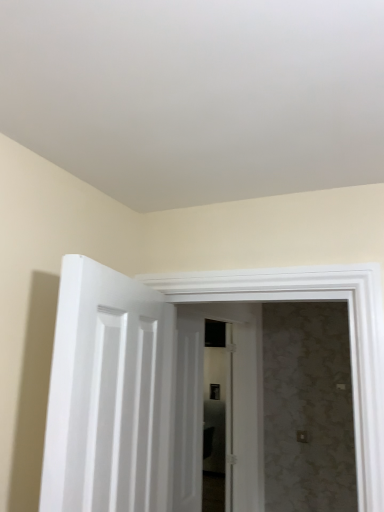
Where is `white painted wood door at left, which is the 2th door in back-to-front order`? The height and width of the screenshot is (512, 384). white painted wood door at left, which is the 2th door in back-to-front order is located at coordinates click(108, 394).

This screenshot has width=384, height=512. Describe the element at coordinates (108, 394) in the screenshot. I see `white painted wood door at left, which is the 2th door in back-to-front order` at that location.

Describe the element at coordinates (225, 406) in the screenshot. I see `white wooden door at center, the first door positioned from the back` at that location.

Where is `white wooden door at center, the first door positioned from the back`? white wooden door at center, the first door positioned from the back is located at coordinates (225, 406).

Identify the location of white painted wood door at left, positioned as the 1th door in front-to-back order. (108, 394).

Can you confirm if white painted wood door at left, positioned as the 1th door in front-to-back order, is positioned to the right of white wooden door at center, the first door positioned from the back?

No.

Between white painted wood door at left, which is the 2th door in back-to-front order, and white wooden door at center, marked as the 2th door in a front-to-back arrangement, which one is positioned behind?

white wooden door at center, marked as the 2th door in a front-to-back arrangement, is further away from the camera.

Is point (59, 426) in front of point (187, 473)?

Yes.

Based on the photo, from the image's perspective, is white painted wood door at left, which is the 2th door in back-to-front order, below white wooden door at center, marked as the 2th door in a front-to-back arrangement?

No, from the image's perspective, white painted wood door at left, which is the 2th door in back-to-front order, is not below white wooden door at center, marked as the 2th door in a front-to-back arrangement.

From a real-world perspective, is white painted wood door at left, which is the 2th door in back-to-front order, above or below white wooden door at center, the first door positioned from the back?

In terms of real-world spatial position, white painted wood door at left, which is the 2th door in back-to-front order, is above white wooden door at center, the first door positioned from the back.

Can you confirm if white painted wood door at left, which is the 2th door in back-to-front order, is thinner than white wooden door at center, the first door positioned from the back?

Correct, the width of white painted wood door at left, which is the 2th door in back-to-front order, is less than that of white wooden door at center, the first door positioned from the back.

Between white painted wood door at left, which is the 2th door in back-to-front order, and white wooden door at center, marked as the 2th door in a front-to-back arrangement, which one has more height?

white wooden door at center, marked as the 2th door in a front-to-back arrangement.

Considering the sizes of objects white painted wood door at left, which is the 2th door in back-to-front order, and white wooden door at center, marked as the 2th door in a front-to-back arrangement, in the image provided, who is bigger, white painted wood door at left, which is the 2th door in back-to-front order, or white wooden door at center, marked as the 2th door in a front-to-back arrangement,?

With larger size is white wooden door at center, marked as the 2th door in a front-to-back arrangement.

Is white wooden door at center, the first door positioned from the back, completely or partially inside white painted wood door at left, positioned as the 1th door in front-to-back order?

No, white painted wood door at left, positioned as the 1th door in front-to-back order, does not contain white wooden door at center, the first door positioned from the back.

Is white painted wood door at left, which is the 2th door in back-to-front order, directly adjacent to white wooden door at center, the first door positioned from the back?

white painted wood door at left, which is the 2th door in back-to-front order, is not next to white wooden door at center, the first door positioned from the back, and they're not touching.

Is white painted wood door at left, which is the 2th door in back-to-front order, oriented away from white wooden door at center, marked as the 2th door in a front-to-back arrangement?

No, white wooden door at center, marked as the 2th door in a front-to-back arrangement, is not at the back of white painted wood door at left, which is the 2th door in back-to-front order.

Can you tell me how much white painted wood door at left, which is the 2th door in back-to-front order, and white wooden door at center, the first door positioned from the back, differ in facing direction?

There is a 15.9-degree angle between the facing directions of white painted wood door at left, which is the 2th door in back-to-front order, and white wooden door at center, the first door positioned from the back.

This screenshot has height=512, width=384. Find the location of `door above the white wooden door at center, the first door positioned from the back (from the image's perspective)`. door above the white wooden door at center, the first door positioned from the back (from the image's perspective) is located at coordinates (108, 394).

Considering the positions of objects white wooden door at center, the first door positioned from the back, and white painted wood door at left, positioned as the 1th door in front-to-back order, in the image provided, who is more to the left, white wooden door at center, the first door positioned from the back, or white painted wood door at left, positioned as the 1th door in front-to-back order,?

white painted wood door at left, positioned as the 1th door in front-to-back order, is more to the left.

Is white wooden door at center, the first door positioned from the back, further to camera compared to white painted wood door at left, which is the 2th door in back-to-front order?

Yes, white wooden door at center, the first door positioned from the back, is behind white painted wood door at left, which is the 2th door in back-to-front order.

Is point (226, 402) closer to camera compared to point (169, 402)?

No, (226, 402) is behind (169, 402).

From the image's perspective, does white wooden door at center, the first door positioned from the back, appear lower than white painted wood door at left, which is the 2th door in back-to-front order?

Correct, white wooden door at center, the first door positioned from the back, appears lower than white painted wood door at left, which is the 2th door in back-to-front order, in the image.

From a real-world perspective, is white wooden door at center, marked as the 2th door in a front-to-back arrangement, on top of white painted wood door at left, positioned as the 1th door in front-to-back order?

Incorrect, from a real-world perspective, white wooden door at center, marked as the 2th door in a front-to-back arrangement, is lower than white painted wood door at left, positioned as the 1th door in front-to-back order.

Considering the sizes of white wooden door at center, the first door positioned from the back, and white painted wood door at left, positioned as the 1th door in front-to-back order, in the image, is white wooden door at center, the first door positioned from the back, wider or thinner than white painted wood door at left, positioned as the 1th door in front-to-back order,?

Clearly, white wooden door at center, the first door positioned from the back, has more width compared to white painted wood door at left, positioned as the 1th door in front-to-back order.

Considering the relative sizes of white wooden door at center, marked as the 2th door in a front-to-back arrangement, and white painted wood door at left, positioned as the 1th door in front-to-back order, in the image provided, is white wooden door at center, marked as the 2th door in a front-to-back arrangement, shorter than white painted wood door at left, positioned as the 1th door in front-to-back order,?

No, white wooden door at center, marked as the 2th door in a front-to-back arrangement, is not shorter than white painted wood door at left, positioned as the 1th door in front-to-back order.

Does white wooden door at center, the first door positioned from the back, have a smaller size compared to white painted wood door at left, which is the 2th door in back-to-front order?

Incorrect, white wooden door at center, the first door positioned from the back, is not smaller in size than white painted wood door at left, which is the 2th door in back-to-front order.

Can we say white wooden door at center, the first door positioned from the back, lies outside white painted wood door at left, which is the 2th door in back-to-front order?

Absolutely, white wooden door at center, the first door positioned from the back, is external to white painted wood door at left, which is the 2th door in back-to-front order.

Is white wooden door at center, the first door positioned from the back, positioned far away from white painted wood door at left, positioned as the 1th door in front-to-back order?

Absolutely, white wooden door at center, the first door positioned from the back, is distant from white painted wood door at left, positioned as the 1th door in front-to-back order.

Is white wooden door at center, the first door positioned from the back, facing away from white painted wood door at left, positioned as the 1th door in front-to-back order?

No, white wooden door at center, the first door positioned from the back, is not facing the opposite direction of white painted wood door at left, positioned as the 1th door in front-to-back order.

Could you measure the distance between white wooden door at center, marked as the 2th door in a front-to-back arrangement, and white painted wood door at left, which is the 2th door in back-to-front order?

The distance of white wooden door at center, marked as the 2th door in a front-to-back arrangement, from white painted wood door at left, which is the 2th door in back-to-front order, is 1.94 meters.

What are the coordinates of `door above the white wooden door at center, marked as the 2th door in a front-to-back arrangement (from a real-world perspective)` in the screenshot? It's located at (108, 394).

Locate an element on the screen. This screenshot has height=512, width=384. door in front of the white wooden door at center, the first door positioned from the back is located at coordinates (108, 394).

Locate an element on the screen. The image size is (384, 512). door lying on the left of white wooden door at center, marked as the 2th door in a front-to-back arrangement is located at coordinates (108, 394).